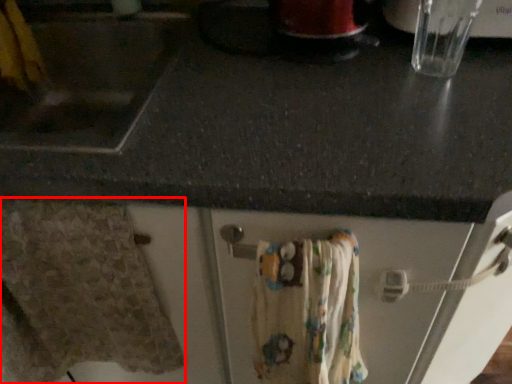
Question: Observing the image, what is the correct spatial positioning of bath towel (annotated by the red box) in reference to bath towel?

Choices:
 (A) right
 (B) left

Answer: (B)